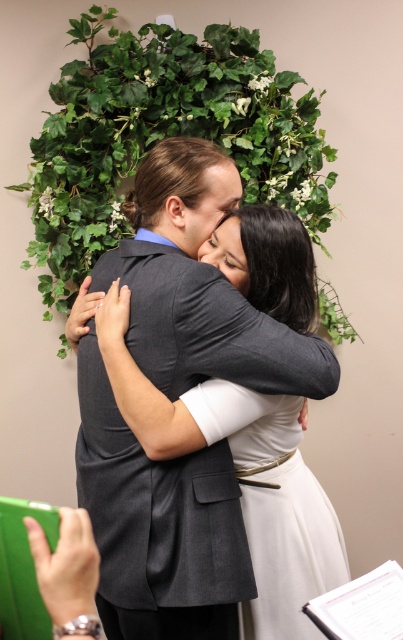
Who is more forward, (116, 608) or (286, 180)?

Point (116, 608) is more forward.

Which is more to the right, dark gray suit at center or green leafy ivy at upper center?

Positioned to the right is dark gray suit at center.

Between point (168, 532) and point (267, 156), which one is positioned in front?

Point (168, 532) is in front.

You are a GUI agent. You are given a task and a screenshot of the screen. Output one action in this format:
    pyautogui.click(x=<x>, y=<y>)
    Task: Click on the dark gray suit at center
    This screenshot has width=403, height=640.
    Given the screenshot: What is the action you would take?
    pyautogui.click(x=155, y=524)